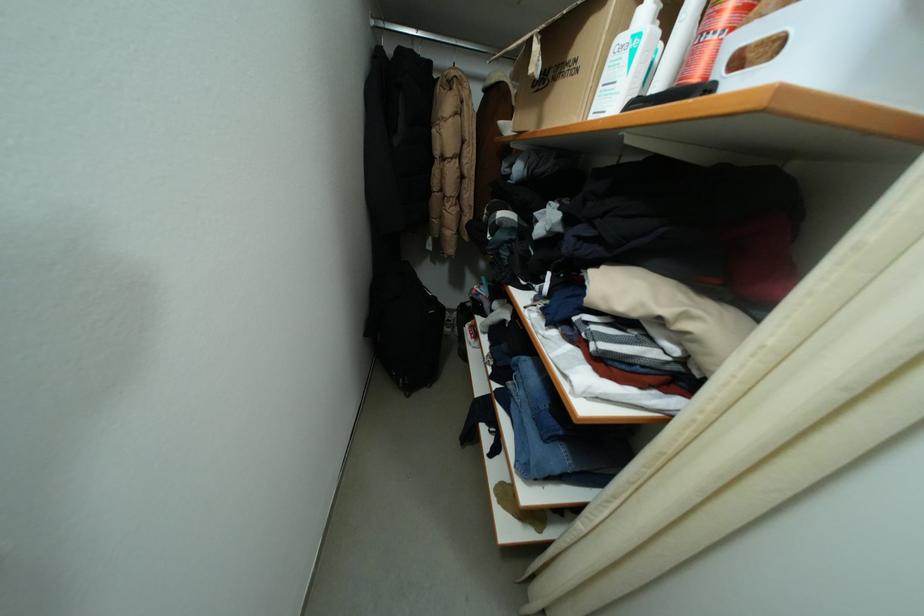
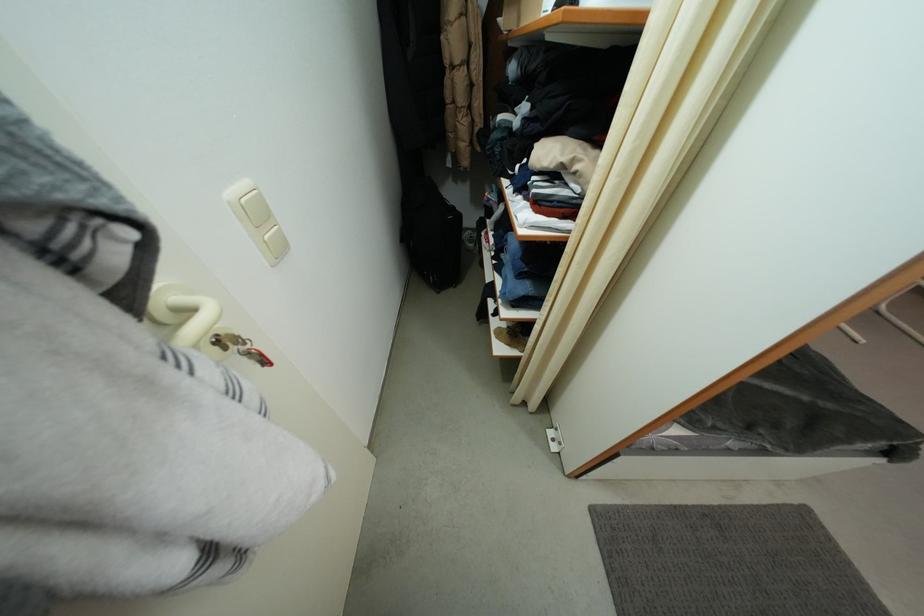
Where in the second image is the point corresponding to [527,523] from the first image?

(517, 347)